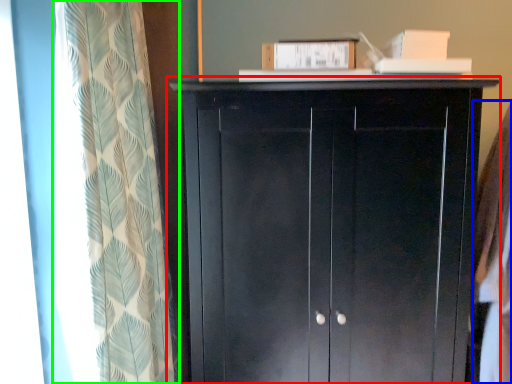
Question: Estimate the real-world distances between objects in this image. Which object is farther from cupboard (highlighted by a red box), clothing (highlighted by a blue box) or curtain (highlighted by a green box)?

Choices:
 (A) clothing
 (B) curtain

Answer: (A)